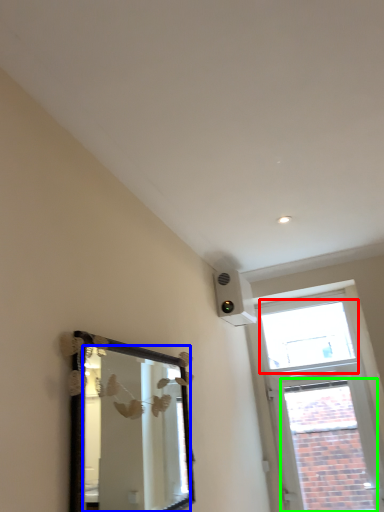
Question: Which object is positioned closest to window (highlighted by a red box)? Select from mirror (highlighted by a blue box) and window (highlighted by a green box).

Choices:
 (A) mirror
 (B) window

Answer: (B)